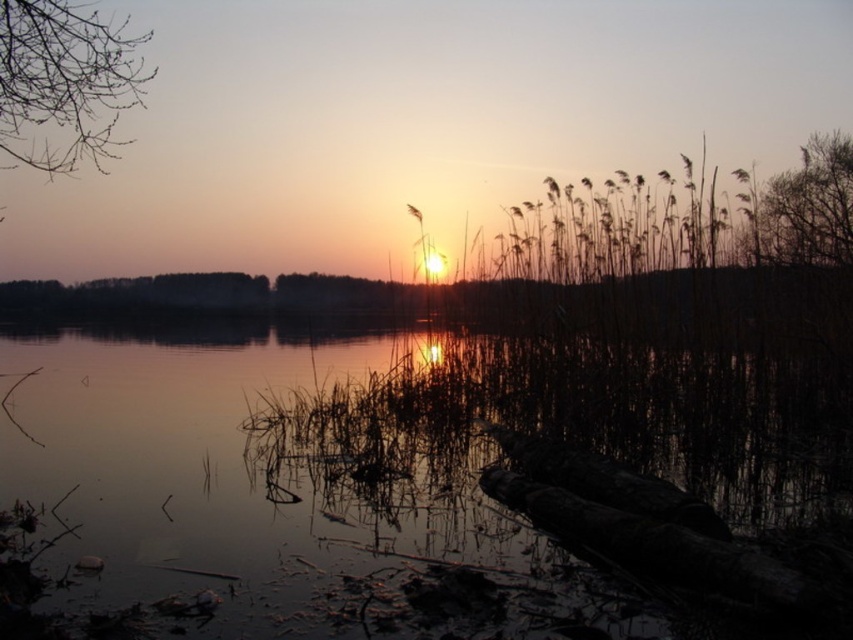
You are standing at the edge of the lake and see the point marked at coordinates point (360,442). Based on the scene description, is this point located on the water or on land?

The point (360,442) is on transparent water at center, so it is located on the water.